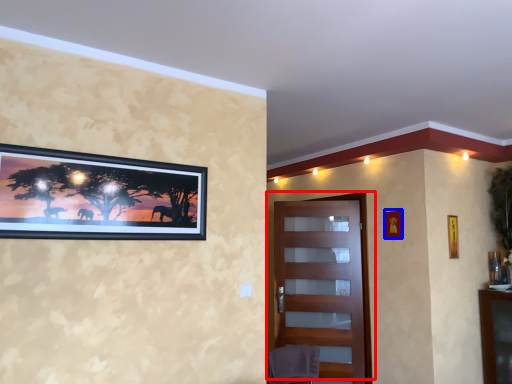
Question: Which point is further to the camera, door (highlighted by a red box) or picture frame (highlighted by a blue box)?

Choices:
 (A) door
 (B) picture frame

Answer: (A)